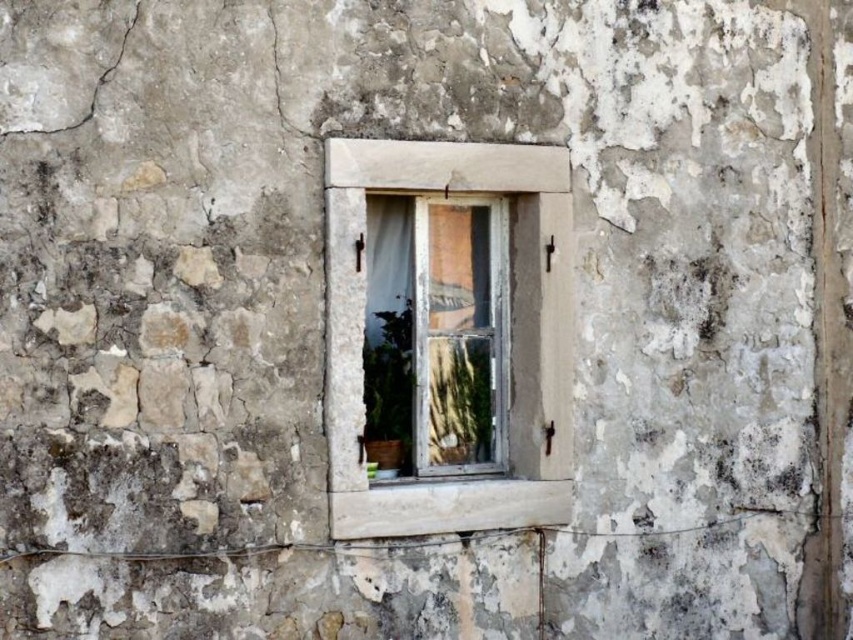
Question: Does white stone window frame at center come in front of white wooden window at center?

Choices:
 (A) yes
 (B) no

Answer: (A)

Question: Does white stone window frame at center appear on the left side of white wooden window at center?

Choices:
 (A) no
 (B) yes

Answer: (A)

Question: Can you confirm if white stone window frame at center is positioned to the left of white wooden window at center?

Choices:
 (A) yes
 (B) no

Answer: (B)

Question: Among these points, which one is nearest to the camera?

Choices:
 (A) (347, 449)
 (B) (502, 198)

Answer: (A)